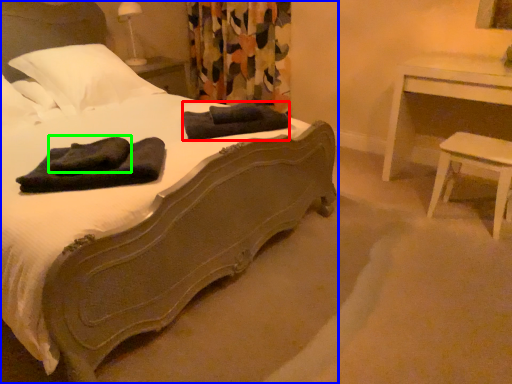
Question: Which object is positioned farthest from bath towel (highlighted by a red box)? Select from bed (highlighted by a blue box) and bath towel (highlighted by a green box).

Choices:
 (A) bed
 (B) bath towel

Answer: (B)